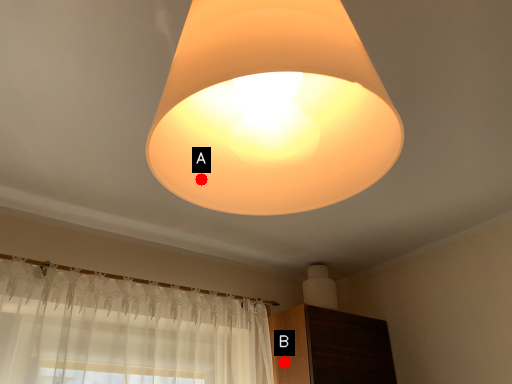
Question: Two points are circled on the image, labeled by A and B beside each circle. Which of the following is the closest to the observer?

Choices:
 (A) A is closer
 (B) B is closer

Answer: (A)